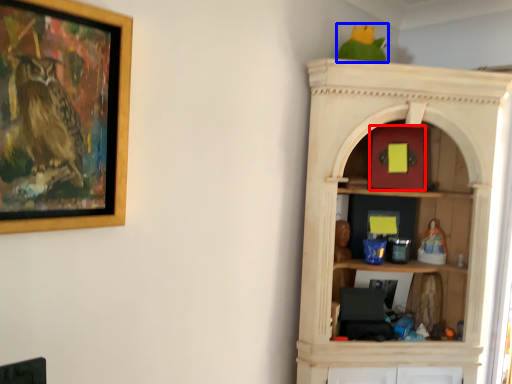
Question: Which point is further to the camera, toy (highlighted by a red box) or parrot (highlighted by a blue box)?

Choices:
 (A) toy
 (B) parrot

Answer: (A)